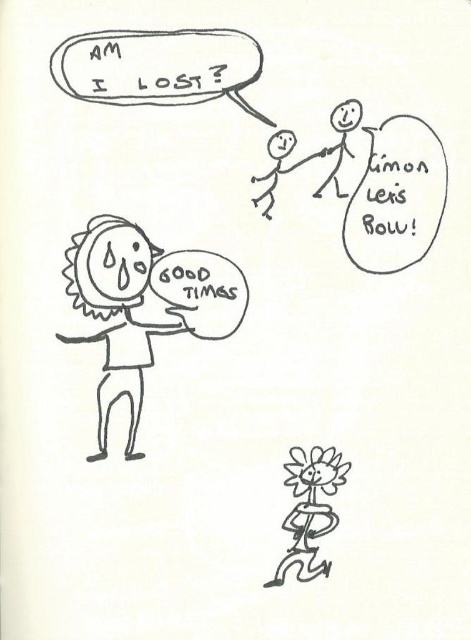
Question: Which object is the farthest from the sun-shaped face at left?

Choices:
 (A) smooth stick figure at upper right
 (B) black line drawing stick figure at upper center
 (C) flower-patterned stick figure at lower right

Answer: (A)

Question: Based on their relative distances, which object is nearer to the black line drawing stick figure at upper center?

Choices:
 (A) smooth stick figure at upper right
 (B) flower-patterned stick figure at lower right
 (C) sun-shaped face at left

Answer: (A)

Question: Can you confirm if sun-shaped face at left is smaller than smooth stick figure at upper right?

Choices:
 (A) no
 (B) yes

Answer: (A)

Question: Which point is farther from the camera taking this photo?

Choices:
 (A) (138, 340)
 (B) (351, 109)

Answer: (A)

Question: Does sun-shaped face at left appear over black line drawing stick figure at upper center?

Choices:
 (A) yes
 (B) no

Answer: (B)

Question: Is black line drawing stick figure at upper center in front of smooth stick figure at upper right?

Choices:
 (A) no
 (B) yes

Answer: (A)